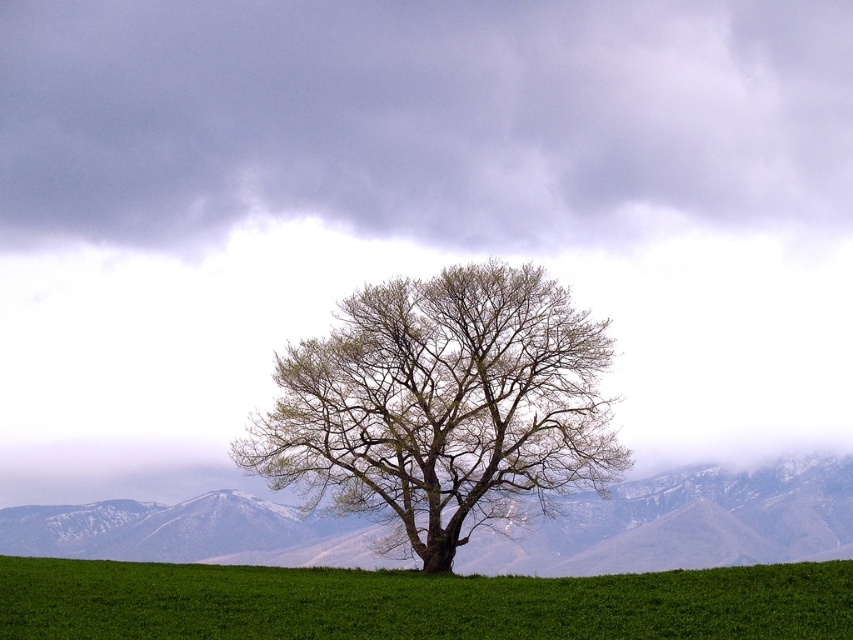
Question: Which of the following is the farthest from the observer?

Choices:
 (A) snowy rock mountain at center
 (B) bare branches at center
 (C) green grassy field at center

Answer: (A)

Question: Which point is farther from the camera taking this photo?

Choices:
 (A) (701, 525)
 (B) (349, 612)

Answer: (A)

Question: Considering the real-world distances, which object is farthest from the green grassy field at center?

Choices:
 (A) snowy rock mountain at center
 (B) bare branches at center

Answer: (A)

Question: Is the position of green grassy field at center more distant than that of snowy rock mountain at center?

Choices:
 (A) yes
 (B) no

Answer: (B)

Question: Can you confirm if bare branches at center is smaller than green grassy field at center?

Choices:
 (A) yes
 (B) no

Answer: (A)

Question: Does green grassy field at center lie in front of snowy rock mountain at center?

Choices:
 (A) no
 (B) yes

Answer: (B)